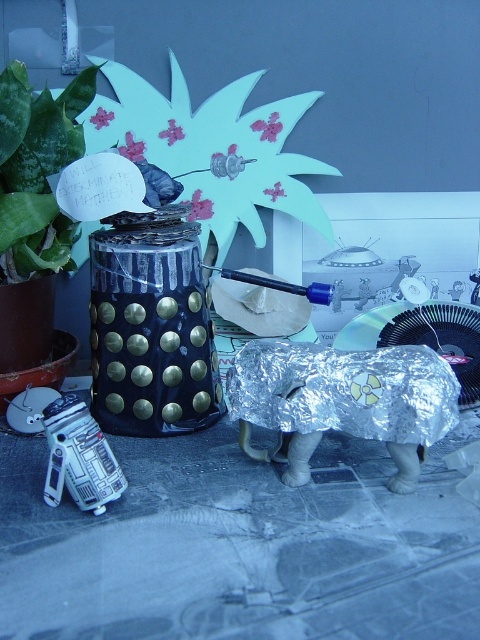
You are a delivery drone that needs to place a package between the shiny metallic elephant at lower right and the green leafy plant at upper left. The package requires a minimum of 12 inches of space to be safely placed. Based on the scene, can you determine if there is enough space between them to safely place the package?

The shiny metallic elephant at lower right is 10.72 inches away from the green leafy plant at upper left. Since the required space is 12 inches and the available space is less than that, the package cannot be safely placed between them.